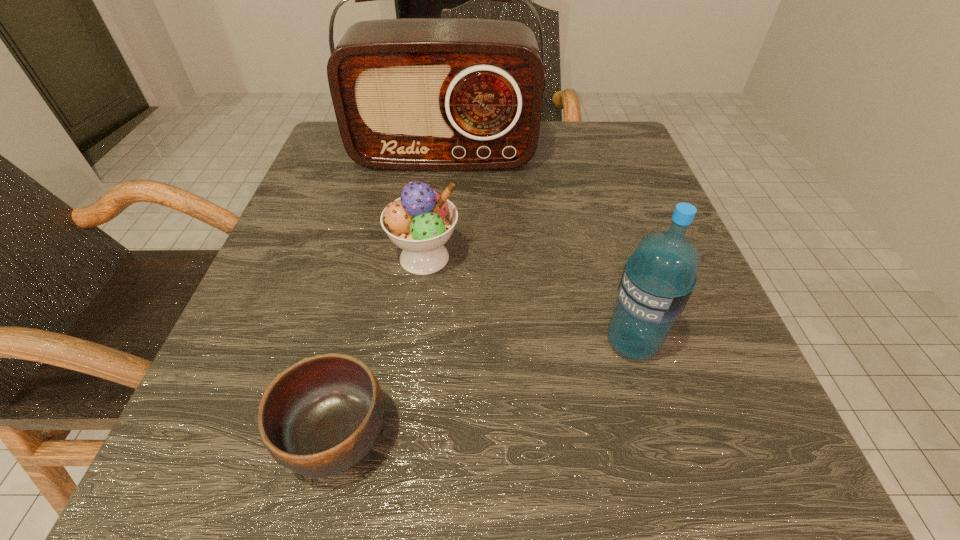
At what (x,y) coordinates should I click in order to perform the action: click on vacant space situated on the right of the third nearest object. Please return your answer as a coordinate pair (x, y). Looking at the image, I should click on (671, 258).

Where is `vacant space located 0.060m on the left of the shortest object`? The image size is (960, 540). vacant space located 0.060m on the left of the shortest object is located at coordinates (230, 437).

Find the location of `object located at the far edge`. object located at the far edge is located at coordinates coord(420,94).

Identify the location of object that is at the near edge. (321, 416).

Locate an element on the screen. Image resolution: width=960 pixels, height=540 pixels. radio receiver present at the left edge is located at coordinates (420, 94).

Where is `bowl located in the left edge section of the desktop`? This screenshot has width=960, height=540. bowl located in the left edge section of the desktop is located at coordinates (321, 416).

Where is `object present at the right edge`? object present at the right edge is located at coordinates (658, 279).

You are a GUI agent. You are given a task and a screenshot of the screen. Output one action in this format:
    pyautogui.click(x=<x>, y=<y>)
    Task: Click on the object that is positioned at the far left corner
    The image size is (960, 540).
    Given the screenshot: What is the action you would take?
    pyautogui.click(x=420, y=94)

Image resolution: width=960 pixels, height=540 pixels. What are the coordinates of `object at the near left corner` in the screenshot? It's located at (321, 416).

In the image, there is a desktop. Identify the location of free space at the far edge. (554, 127).